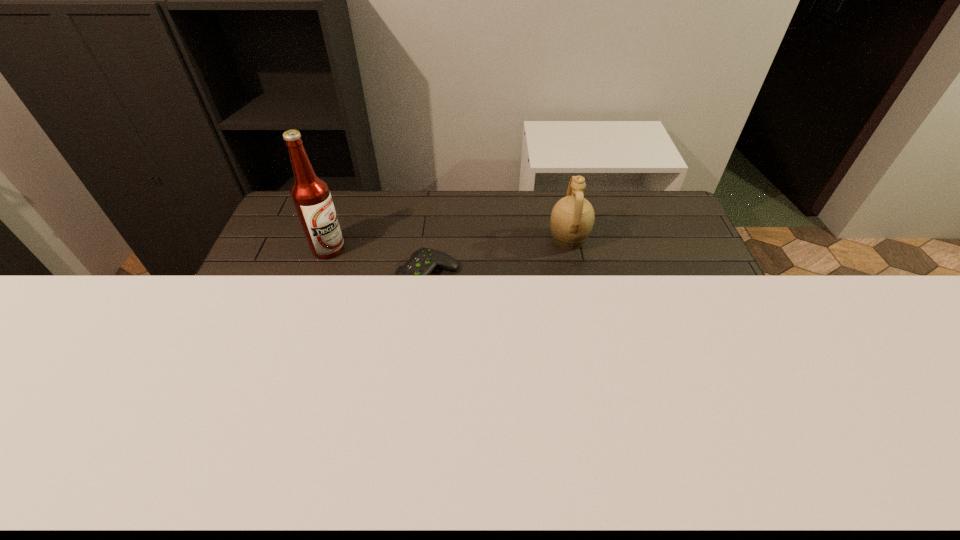
The height and width of the screenshot is (540, 960). Find the location of `object at the left edge`. object at the left edge is located at coordinates (310, 194).

At what (x,y) coordinates should I click in order to perform the action: click on free location at the far edge of the desktop. Please return your answer as a coordinate pair (x, y). Looking at the image, I should click on (467, 208).

At what (x,y) coordinates should I click in order to perform the action: click on blank space at the near edge of the desktop. Please return your answer as a coordinate pair (x, y). Looking at the image, I should click on (543, 468).

Where is `free space at the left edge of the desktop`? free space at the left edge of the desktop is located at coordinates (217, 368).

In the image, there is a desktop. At what (x,y) coordinates should I click in order to perform the action: click on vacant space at the right edge. Please return your answer as a coordinate pair (x, y). The image size is (960, 540). Looking at the image, I should click on (722, 322).

Locate an element on the screen. vacant space that's between the second shortest object and the control is located at coordinates (498, 259).

Identify the location of empty space between the shortest object and the alcohol. (378, 264).

Image resolution: width=960 pixels, height=540 pixels. I want to click on free space that is in between the tallest object and the shortest object, so [x=378, y=264].

This screenshot has height=540, width=960. I want to click on vacant region between the leftmost object and the rightmost object, so [448, 244].

This screenshot has height=540, width=960. Identify the location of free space that is in between the shortest object and the alcohol. 378,264.